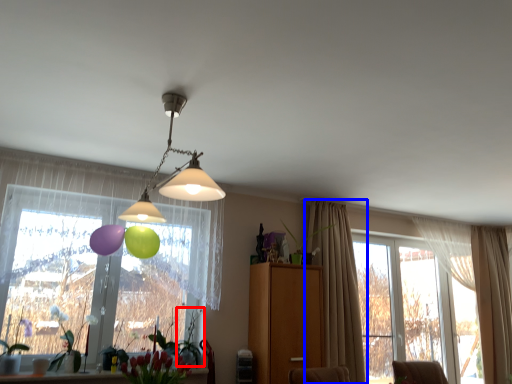
Question: Which object appears farthest to the camera in this image, plant (highlighted by a red box) or curtain (highlighted by a blue box)?

Choices:
 (A) plant
 (B) curtain

Answer: (B)